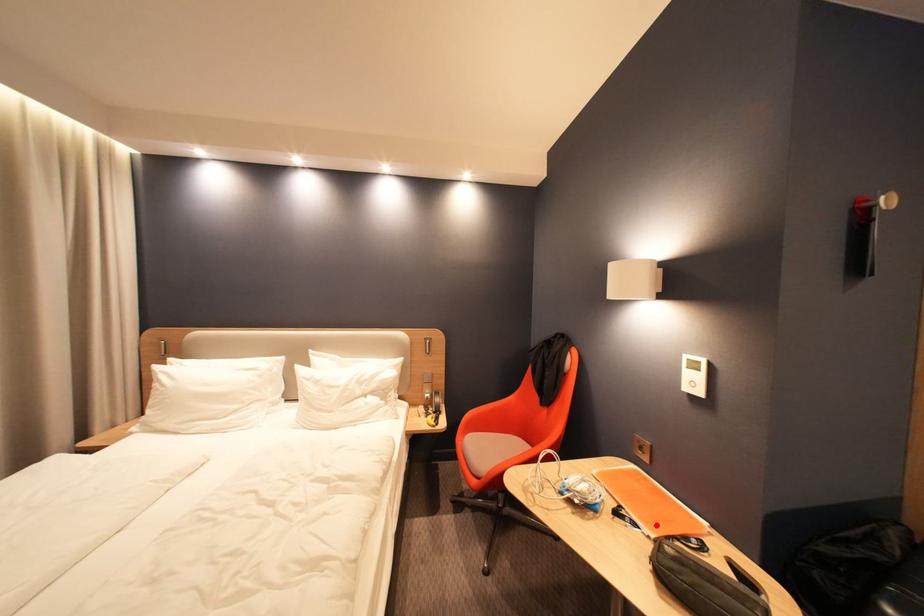
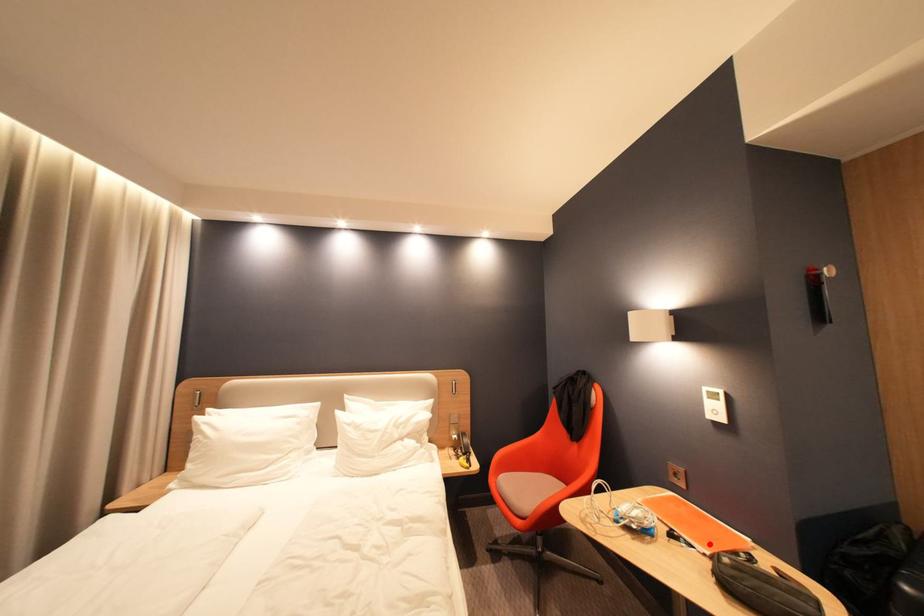
I am providing you with two images of the same scene from different viewpoints. A red point is marked on the first image and another point is marked on the second image. Is the red point in image1 aligned with the point shown in image2?

Yes